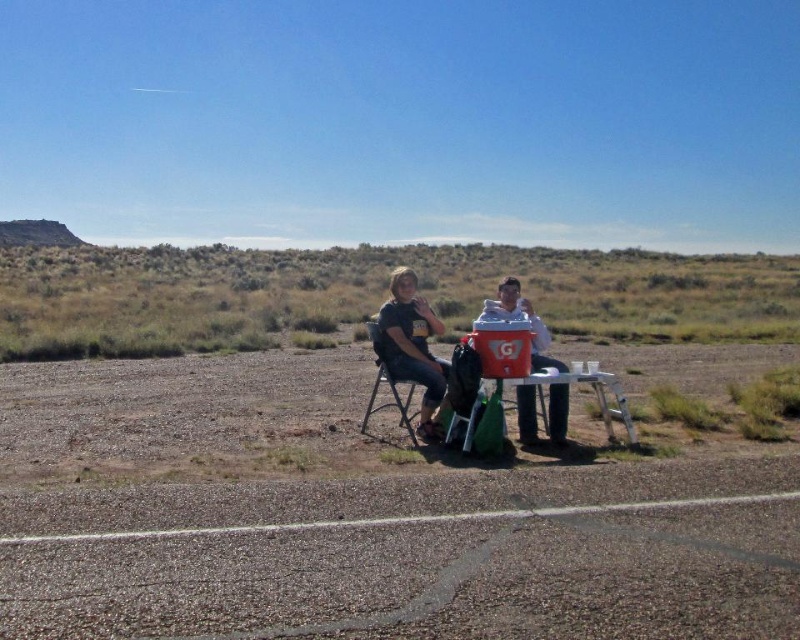
You are a photographer setting up a shot of the two people in the scene. You need to ensure that the matte black shirt at center and the black plastic chair at center are both clearly visible in the frame. Considering their sizes, which object might require you to adjust your camera angle to avoid being too dominant in the composition?

The matte black shirt at center is wider than the black plastic chair at center, so it might require adjusting the camera angle to prevent it from dominating the composition.

You are planning to place a small snack on the matte plastic table at center so that the person wearing the white fabric shirt at center can easily reach it. Where should you place the snack on the table?

The white fabric shirt at center is to the left of the matte plastic table at center, so placing the snack on the left side of the table would be closer to the person wearing the white fabric shirt at center.

You are a photographer planning to take a photo of the dirt field at center and the matte black shirt at center. Which object should you focus on first if you want to capture both in sharp focus?

The dirt field at center is shorter than the matte black shirt at center, so you should focus on the matte black shirt at center first to ensure both are in sharp focus.